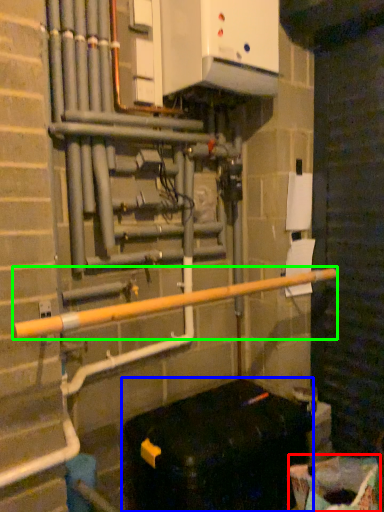
Question: Estimate the real-world distances between objects in this image. Which object is farther from recycling bin (highlighted by a red box), furniture (highlighted by a blue box) or rail (highlighted by a green box)?

Choices:
 (A) furniture
 (B) rail

Answer: (B)